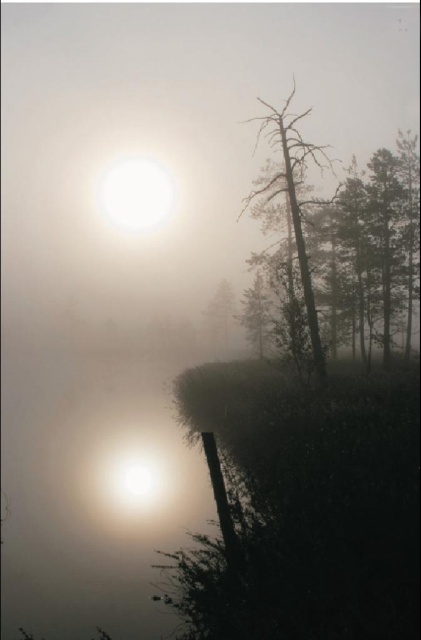
Question: Is brown textured tree at right wider than smooth green tree at center?

Choices:
 (A) no
 (B) yes

Answer: (B)

Question: Among these objects, which one is farthest from the camera?

Choices:
 (A) smooth green tree at center
 (B) brown textured tree at right

Answer: (A)

Question: Which of the following is the closest to the observer?

Choices:
 (A) brown textured tree at right
 (B) smooth green tree at center

Answer: (A)

Question: Is brown textured tree at right to the left of smooth green tree at center from the viewer's perspective?

Choices:
 (A) no
 (B) yes

Answer: (A)

Question: Can you confirm if brown textured tree at right is wider than smooth green tree at center?

Choices:
 (A) no
 (B) yes

Answer: (B)